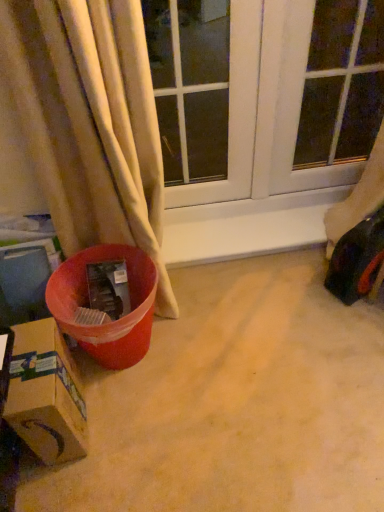
Question: Is transparent glass window at center to the left of transparent glass window screen at upper right from the viewer's perspective?

Choices:
 (A) no
 (B) yes

Answer: (B)

Question: Is transparent glass window at center completely or partially outside of transparent glass window screen at upper right?

Choices:
 (A) yes
 (B) no

Answer: (A)

Question: Does transparent glass window at center have a lesser height compared to transparent glass window screen at upper right?

Choices:
 (A) no
 (B) yes

Answer: (A)

Question: Is transparent glass window at center thinner than transparent glass window screen at upper right?

Choices:
 (A) yes
 (B) no

Answer: (B)

Question: Is the depth of transparent glass window at center greater than that of transparent glass window screen at upper right?

Choices:
 (A) yes
 (B) no

Answer: (B)

Question: Looking at their shapes, would you say cardboard box at lower left is wider or thinner than transparent glass window screen at upper right?

Choices:
 (A) wide
 (B) thin

Answer: (A)

Question: From the image's perspective, is cardboard box at lower left positioned above or below transparent glass window screen at upper right?

Choices:
 (A) below
 (B) above

Answer: (A)

Question: Is cardboard box at lower left bigger or smaller than transparent glass window screen at upper right?

Choices:
 (A) small
 (B) big

Answer: (A)

Question: Is point coord(28,323) closer or farther from the camera than point coord(345,142)?

Choices:
 (A) closer
 (B) farther

Answer: (A)

Question: Is cardboard box at lower left situated inside shiny plastic toy car at right or outside?

Choices:
 (A) outside
 (B) inside

Answer: (A)

Question: Considering their positions, is cardboard box at lower left located in front of or behind shiny plastic toy car at right?

Choices:
 (A) behind
 (B) front

Answer: (B)

Question: From the image's perspective, is cardboard box at lower left above or below shiny plastic toy car at right?

Choices:
 (A) above
 (B) below

Answer: (B)

Question: Is point (52, 400) closer or farther from the camera than point (377, 215)?

Choices:
 (A) closer
 (B) farther

Answer: (A)

Question: In the image, is shiny plastic toy car at right positioned in front of or behind transparent glass window at center?

Choices:
 (A) front
 (B) behind

Answer: (B)

Question: Is shiny plastic toy car at right to the left or to the right of transparent glass window at center in the image?

Choices:
 (A) left
 (B) right

Answer: (B)